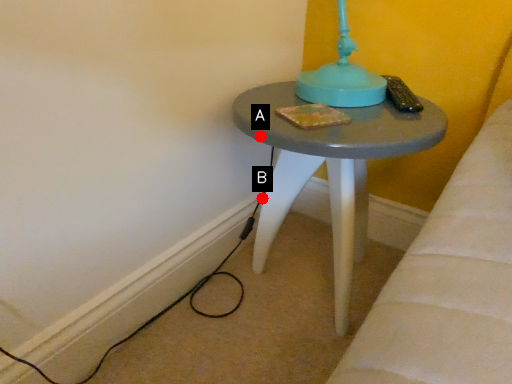
Question: Two points are circled on the image, labeled by A and B beside each circle. Among these points, which one is farthest from the camera?

Choices:
 (A) A is further
 (B) B is further

Answer: (B)